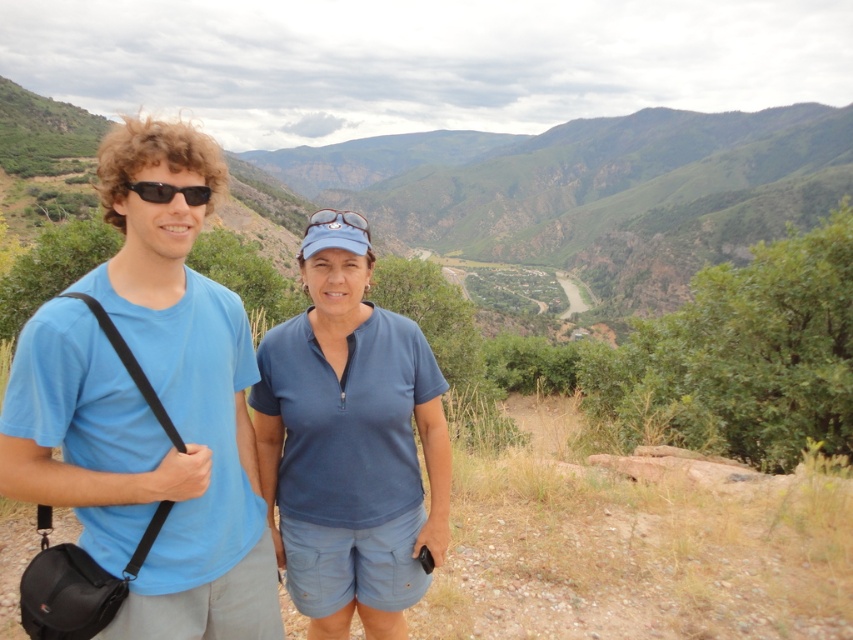
Who is positioned more to the right, blue cotton shirt at center or blue matte sunglasses at center?

From the viewer's perspective, blue cotton shirt at center appears more on the right side.

Who is higher up, blue cotton shirt at center or blue matte sunglasses at center?

blue matte sunglasses at center is above.

The height and width of the screenshot is (640, 853). Describe the element at coordinates (349, 445) in the screenshot. I see `blue cotton shirt at center` at that location.

Where is `blue cotton shirt at center`? The height and width of the screenshot is (640, 853). blue cotton shirt at center is located at coordinates (349, 445).

Who is positioned more to the right, blue cotton t-shirt at left or sunglasses at left?

Positioned to the right is sunglasses at left.

Who is more forward, (90, 364) or (141, 195)?

Point (90, 364) is in front.

You are a GUI agent. You are given a task and a screenshot of the screen. Output one action in this format:
    pyautogui.click(x=<x>, y=<y>)
    Task: Click on the blue cotton t-shirt at left
    
    Given the screenshot: What is the action you would take?
    pyautogui.click(x=149, y=410)

Can you confirm if blue cotton t-shirt at left is positioned below blue matte sunglasses at center?

Indeed, blue cotton t-shirt at left is positioned under blue matte sunglasses at center.

Does blue cotton t-shirt at left lie in front of blue matte sunglasses at center?

Yes, it is.

The image size is (853, 640). I want to click on blue cotton t-shirt at left, so click(149, 410).